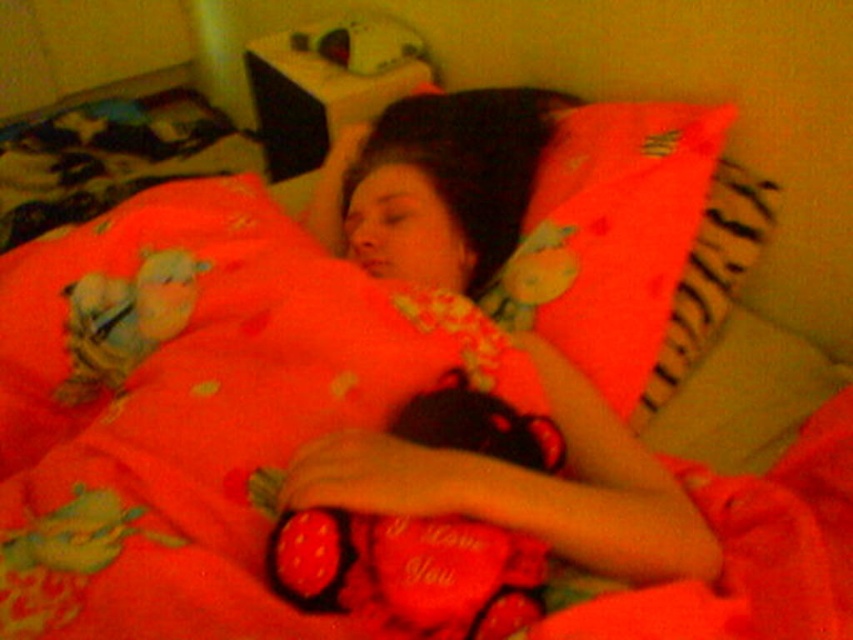
You are a photographer setting up a shoot in this cozy bedroom scene. You need to position a spotlight so that it illuminates the matte fabric woman at center without casting a shadow over the soft plush toy at upper left. Is this possible given their current positions?

The matte fabric woman at center is in front of the soft plush toy at upper left. Therefore, positioning a spotlight directly behind the woman could cast her shadow onto the plush toy. To avoid this, place the spotlight to the side of the woman so that her shadow falls away from the soft plush toy at upper left.

You are a photographer taking a photo of the scene. You want to focus on the person in the center. Is the point at coordinate (529,486) a good focus point for capturing the matte fabric woman at center?

Yes, the point at coordinate (529,486) marks the matte fabric woman at center, so focusing there would effectively capture her in the photo.